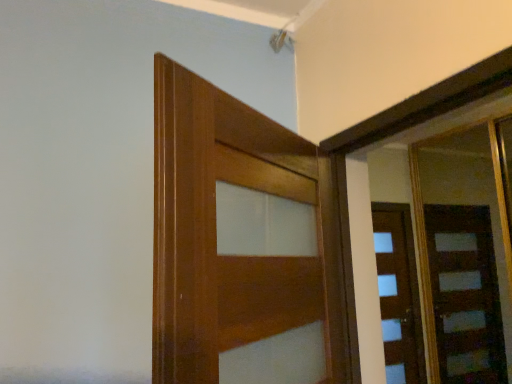
What do you see at coordinates (465, 295) in the screenshot?
I see `wooden door at right, which ranks as the second door in front-to-back order` at bounding box center [465, 295].

The height and width of the screenshot is (384, 512). I want to click on wooden door at right, acting as the 1th door starting from the right, so click(465, 295).

Measure the distance between point (395, 355) and camera.

Point (395, 355) is 3.34 meters away from camera.

The height and width of the screenshot is (384, 512). In order to click on wooden door at center, the second door positioned from the back in this screenshot , I will do `click(216, 234)`.

Describe the element at coordinates (216, 234) in the screenshot. I see `wooden door at center, placed as the 2th door when sorted from right to left` at that location.

At what (x,y) coordinates should I click in order to perform the action: click on wooden door at right, the 2th door when ordered from left to right. Please return your answer as a coordinate pair (x, y). The height and width of the screenshot is (384, 512). Looking at the image, I should click on (465, 295).

Considering the relative positions of wooden door at center, the second door positioned from the back, and wooden door at right, acting as the 1th door starting from the right, in the image provided, is wooden door at center, the second door positioned from the back, to the left of wooden door at right, acting as the 1th door starting from the right, from the viewer's perspective?

Correct, you'll find wooden door at center, the second door positioned from the back, to the left of wooden door at right, acting as the 1th door starting from the right.

Is wooden door at center, the second door positioned from the back, positioned behind wooden door at right, which is the 1th door in back-to-front order?

No, wooden door at center, the second door positioned from the back, is closer to the viewer.

Which is closer to the camera, (181, 198) or (484, 286)?

The point (181, 198) is closer.

From the image's perspective, does wooden door at center, the second door positioned from the back, appear higher than wooden door at right, acting as the 1th door starting from the right?

Answer: Yes.

From a real-world perspective, which is physically below, wooden door at center, the 1th door positioned from the front, or wooden door at right, which ranks as the second door in front-to-back order?

wooden door at center, the 1th door positioned from the front, from a real-world perspective.

Considering the relative sizes of wooden door at center, placed as the 2th door when sorted from right to left, and wooden door at right, which is the 1th door in back-to-front order, in the image provided, is wooden door at center, placed as the 2th door when sorted from right to left, wider than wooden door at right, which is the 1th door in back-to-front order,?

Yes.

Is wooden door at center, the 1th door positioned from the front, shorter than wooden door at right, which is the 1th door in back-to-front order?

Yes, wooden door at center, the 1th door positioned from the front, is shorter than wooden door at right, which is the 1th door in back-to-front order.

In terms of size, does wooden door at center, the 1th door positioned from the front, appear bigger or smaller than wooden door at right, acting as the 1th door starting from the right?

Considering their sizes, wooden door at center, the 1th door positioned from the front, takes up less space than wooden door at right, acting as the 1th door starting from the right.

Is wooden door at center, the 1th door positioned from the front, spatially inside wooden door at right, the 2th door when ordered from left to right, or outside of it?

wooden door at center, the 1th door positioned from the front, exists outside the volume of wooden door at right, the 2th door when ordered from left to right.

Is wooden door at center, placed as the 2th door when sorted from right to left, with wooden door at right, which ranks as the second door in front-to-back order?

There is a gap between wooden door at center, placed as the 2th door when sorted from right to left, and wooden door at right, which ranks as the second door in front-to-back order.

Is wooden door at right, acting as the 1th door starting from the right, at the back of wooden door at center, the second door positioned from the back?

No.

Image resolution: width=512 pixels, height=384 pixels. I want to click on door below the wooden door at center, placed as the 2th door when sorted from right to left (from the image's perspective), so click(465, 295).

Which object is positioned more to the left, wooden door at right, the 2th door when ordered from left to right, or wooden door at center, marked as the first door in a left-to-right arrangement?

wooden door at center, marked as the first door in a left-to-right arrangement, is more to the left.

Considering the positions of objects wooden door at right, acting as the 1th door starting from the right, and wooden door at center, placed as the 2th door when sorted from right to left, in the image provided, who is in front, wooden door at right, acting as the 1th door starting from the right, or wooden door at center, placed as the 2th door when sorted from right to left,?

wooden door at center, placed as the 2th door when sorted from right to left.

From the picture: Which is nearer, (471, 250) or (164, 89)?

The point (164, 89) is closer to the camera.

From the image's perspective, is wooden door at right, which is the 1th door in back-to-front order, beneath wooden door at center, the second door positioned from the back?

Yes, from the image's perspective, wooden door at right, which is the 1th door in back-to-front order, is below wooden door at center, the second door positioned from the back.

From a real-world perspective, relative to wooden door at center, the 1th door positioned from the front, is wooden door at right, which is the 1th door in back-to-front order, vertically above or below?

Clearly, from a real-world perspective, wooden door at right, which is the 1th door in back-to-front order, is above wooden door at center, the 1th door positioned from the front.

From the picture: Can you confirm if wooden door at right, which is the 1th door in back-to-front order, is thinner than wooden door at center, placed as the 2th door when sorted from right to left?

Yes.

Considering the sizes of objects wooden door at right, which ranks as the second door in front-to-back order, and wooden door at center, the second door positioned from the back, in the image provided, who is taller, wooden door at right, which ranks as the second door in front-to-back order, or wooden door at center, the second door positioned from the back,?

Standing taller between the two is wooden door at right, which ranks as the second door in front-to-back order.

Does wooden door at right, acting as the 1th door starting from the right, have a larger size compared to wooden door at center, placed as the 2th door when sorted from right to left?

Correct, wooden door at right, acting as the 1th door starting from the right, is larger in size than wooden door at center, placed as the 2th door when sorted from right to left.

Is wooden door at right, which is the 1th door in back-to-front order, positioned beyond the bounds of wooden door at center, the second door positioned from the back?

Absolutely, wooden door at right, which is the 1th door in back-to-front order, is external to wooden door at center, the second door positioned from the back.

Looking at this image, is wooden door at right, which is the 1th door in back-to-front order, positioned far away from wooden door at center, the 1th door positioned from the front?

That's right, there is a large distance between wooden door at right, which is the 1th door in back-to-front order, and wooden door at center, the 1th door positioned from the front.

Could you tell me if wooden door at right, acting as the 1th door starting from the right, is turned towards wooden door at center, placed as the 2th door when sorted from right to left?

No, wooden door at right, acting as the 1th door starting from the right, is not turned towards wooden door at center, placed as the 2th door when sorted from right to left.

How many degrees apart are the facing directions of wooden door at right, the 2th door when ordered from left to right, and wooden door at center, the 1th door positioned from the front?

124 degrees.

The width and height of the screenshot is (512, 384). What are the coordinates of `door that is above the wooden door at center, placed as the 2th door when sorted from right to left (from a real-world perspective)` in the screenshot? It's located at (465, 295).

Locate an element on the screen. door on the left of wooden door at right, which is the 1th door in back-to-front order is located at coordinates (x=216, y=234).

The image size is (512, 384). I want to click on door that appears behind the wooden door at center, the second door positioned from the back, so click(x=465, y=295).